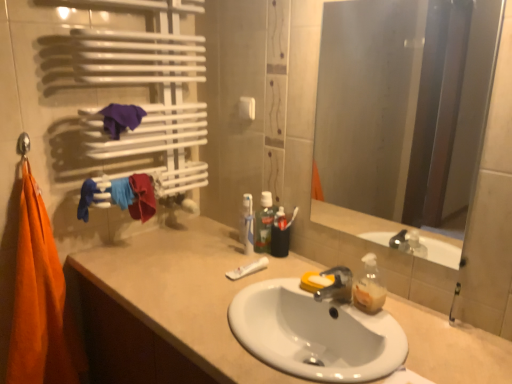
Where is `vacant space behind white matte toothpaste at center`? vacant space behind white matte toothpaste at center is located at coordinates (234, 254).